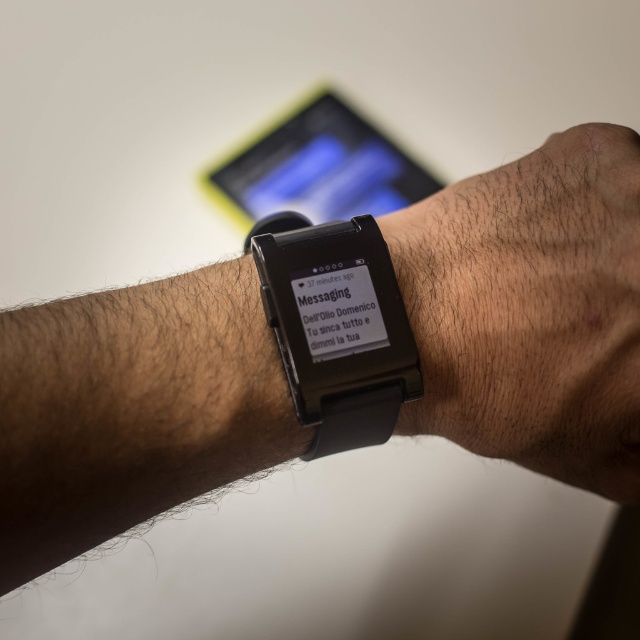
You are a technician working on a smartwatch repair station. The repair station has a grid system with coordinates from 0 to 1 in both x and y directions. Your task is to locate the black matte watch at center on the grid. What are its coordinates?

The coordinates of the black matte watch at center are at point [531,308].

You are holding a ruler and want to measure the distance from your eye to the point marked at coordinates point (500, 193) in the image. Can you determine if this distance is more than 40 centimeters?

The distance between point (500, 193) and the camera is 43.21 centimeters, so yes, the distance is more than 40 centimeters.

You are a tech reviewer comparing two smartwatches displayed on the same table. You need to determine which one is shorter in height. The smartwatches are the black rubber watch at center and the black matte smartwatch at center. Based on the description, which one is shorter?

The black rubber watch at center is shorter in height compared to the black matte smartwatch at center according to the description.